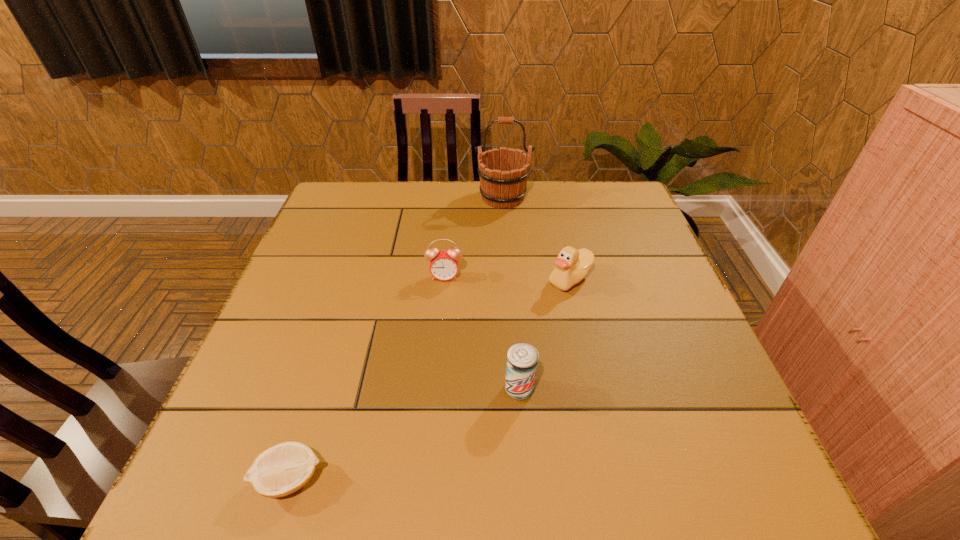
Identify the location of free space located at the beak of the duck. (451, 279).

The image size is (960, 540). What are the coordinates of `free space located at the beak of the duck` in the screenshot? It's located at (439, 279).

Where is `blank area located at the beak of the duck`? blank area located at the beak of the duck is located at coordinates (483, 279).

I want to click on free space located on the back of the nearest object, so click(x=337, y=332).

In order to click on object that is at the far edge in this screenshot , I will do `click(503, 173)`.

Locate an element on the screen. This screenshot has width=960, height=540. object at the near edge is located at coordinates (281, 470).

Identify the location of object that is at the left edge. (281, 470).

Locate an element on the screen. This screenshot has height=540, width=960. object situated at the near left corner is located at coordinates (281, 470).

This screenshot has height=540, width=960. Identify the location of vacant space at the far edge of the desktop. (490, 208).

Locate an element on the screen. The height and width of the screenshot is (540, 960). blank space at the near edge of the desktop is located at coordinates (496, 455).